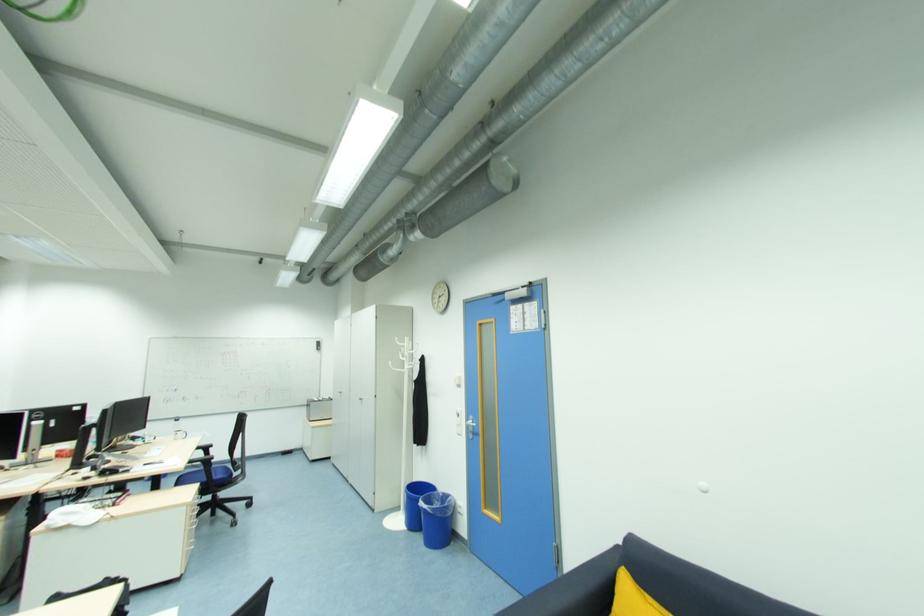
Find where to lift the clear water bottle. Please return your answer as a coordinate pair (x, y).

(43, 480)